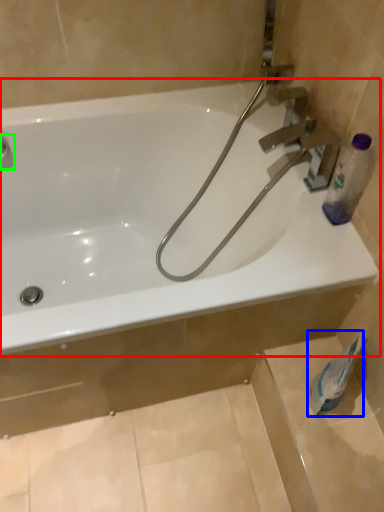
Question: Based on their relative distances, which object is farther from bathtub (highlighted by a red box)? Choose from toilet paper (highlighted by a blue box) and plumbing fixture (highlighted by a green box).

Choices:
 (A) toilet paper
 (B) plumbing fixture

Answer: (A)